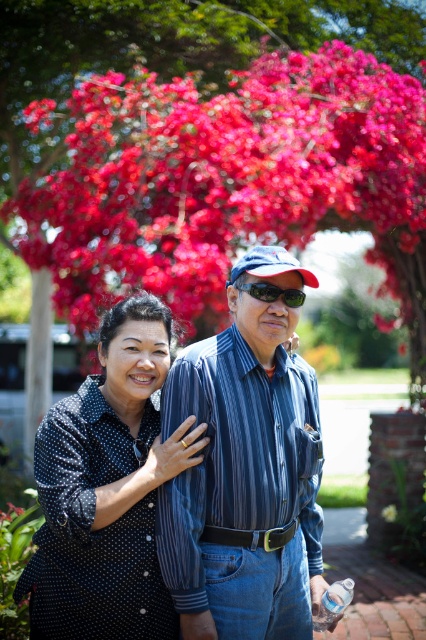
Does vibrant silk flowers at upper center appear on the left side of black dotted shirt at center?

In fact, vibrant silk flowers at upper center is to the right of black dotted shirt at center.

Is vibrant silk flowers at upper center to the right of black dotted shirt at center from the viewer's perspective?

Indeed, vibrant silk flowers at upper center is positioned on the right side of black dotted shirt at center.

Locate an element on the screen. vibrant silk flowers at upper center is located at coordinates (230, 180).

What do you see at coordinates (244, 472) in the screenshot? Image resolution: width=426 pixels, height=640 pixels. I see `blue striped shirt at center` at bounding box center [244, 472].

Find the location of `blue striped shirt at center`. blue striped shirt at center is located at coordinates tap(244, 472).

Does blue striped shirt at center appear over black dotted shirt at center?

Yes, blue striped shirt at center is above black dotted shirt at center.

Is point (233, 563) positioned in front of point (83, 534)?

No, (233, 563) is behind (83, 534).

Which is behind, point (250, 308) or point (74, 470)?

The point (250, 308) is behind.

I want to click on blue striped shirt at center, so click(244, 472).